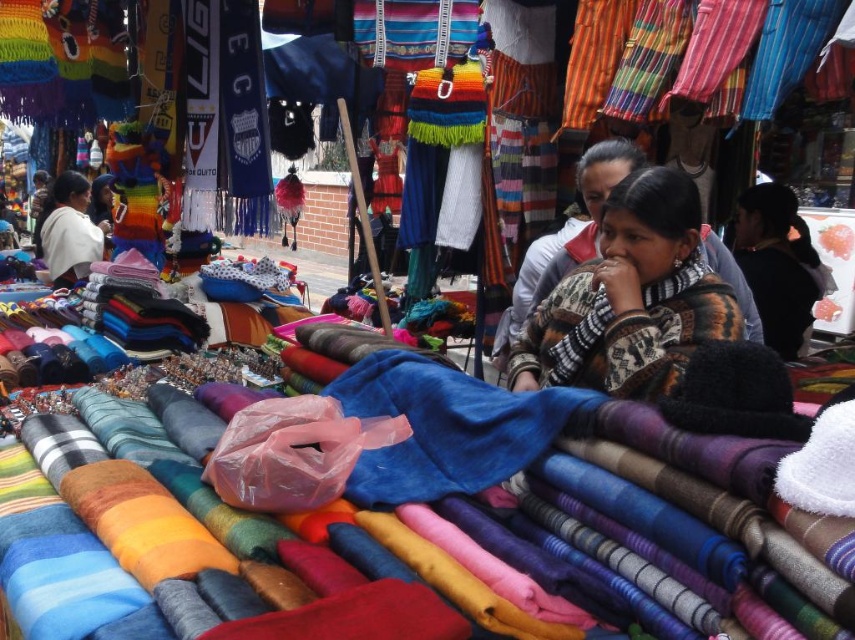
Question: Can you confirm if white woolen sweater at upper left is wider than patterned wool scarf at center?

Choices:
 (A) yes
 (B) no

Answer: (A)

Question: Can you confirm if knitted sweater at center is positioned above white woolen sweater at upper left?

Choices:
 (A) no
 (B) yes

Answer: (A)

Question: Does knitted sweater at center appear over patterned wool scarf at center?

Choices:
 (A) yes
 (B) no

Answer: (B)

Question: Which point is farther from the camera taking this photo?

Choices:
 (A) (565, 337)
 (B) (97, 230)
 (C) (733, 321)

Answer: (B)

Question: Which object appears farthest from the camera in this image?

Choices:
 (A) white woolen sweater at upper left
 (B) patterned wool scarf at center
 (C) knitted sweater at center

Answer: (A)

Question: Which point is closer to the camera?

Choices:
 (A) patterned wool scarf at center
 (B) knitted sweater at center

Answer: (B)